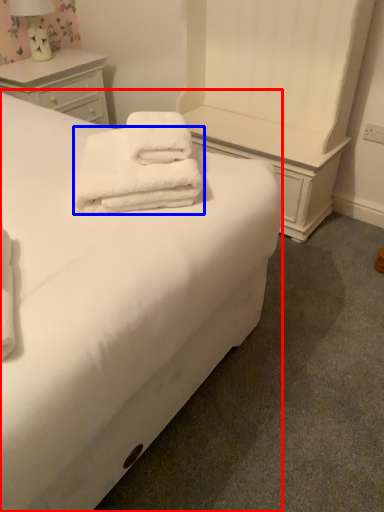
Question: Which object appears farthest to the camera in this image, bed (highlighted by a red box) or towel (highlighted by a blue box)?

Choices:
 (A) bed
 (B) towel

Answer: (B)